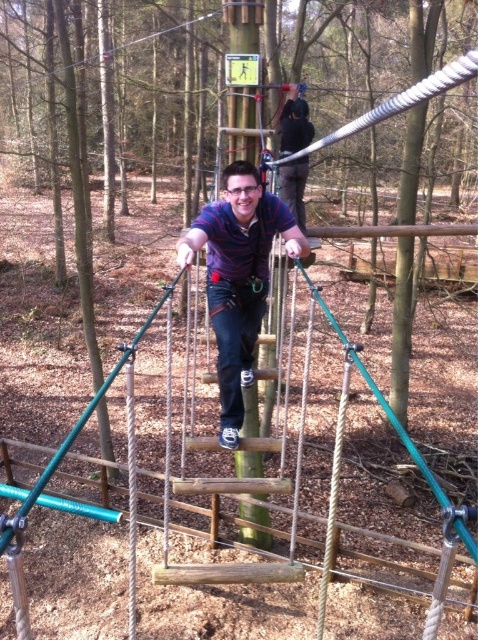
You are standing at the camera position and want to reach the point marked as point (228, 176). Can you estimate how far you need to walk to get there?

The distance between point (228, 176) and the camera is 4.01 meters, so you need to walk approximately 4.01 meters to reach it.

You are an observer at the adventure park. You see two participants wearing the striped cotton shirt at center and the matte blue shirt at center. Which participant is wearing a shorter shirt?

The striped cotton shirt at center is shorter than the matte blue shirt at center, so the participant wearing the striped cotton shirt at center has a shorter shirt.

You are observing two participants in an outdoor adventure course. You notice a striped cotton shirt at center and a matte blue shirt at center. Which participant is standing to the left of the other?

The striped cotton shirt at center is positioned on the left side of matte blue shirt at center, so the participant wearing the striped cotton shirt at center is standing to the left of the one in the matte blue shirt at center.